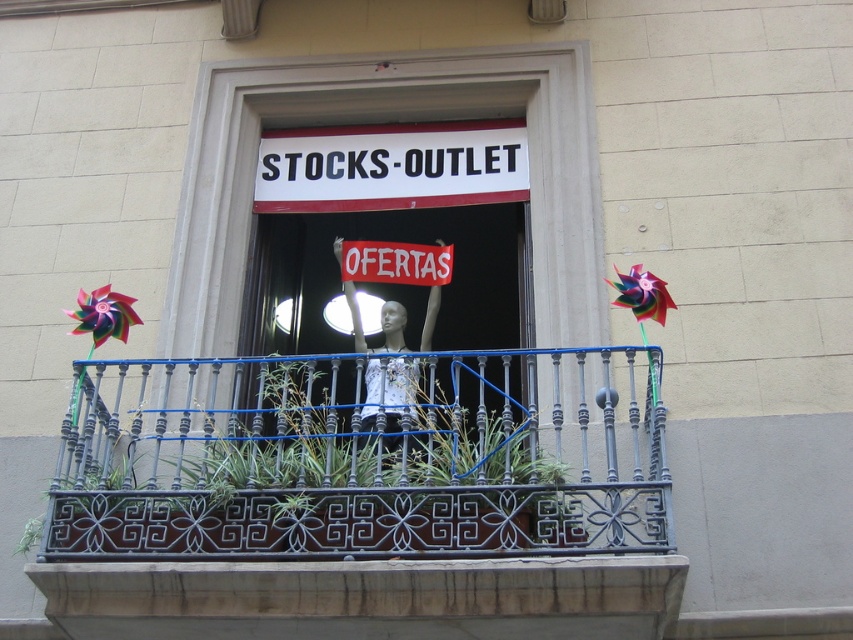
You are a painter standing on the balcony and need to stretch a 3.5 meter long canvas between the dark gray wrought iron at center and the white fabric mannequin at center. Will the canvas be long enough?

The distance between dark gray wrought iron at center and white fabric mannequin at center is 3.18 meters. The canvas is 3.5 meters long, which is longer than the required distance. Therefore, the canvas will be long enough to stretch between them.

You are a delivery person trying to place a new sign on the balcony. The new sign is the same size as the red fabric sign at center. Will the dark gray wrought iron at center block the view of the new sign if placed in the center?

The dark gray wrought iron at center is wider than the red fabric sign at center, so placing the new sign in the center may be blocked by the dark gray wrought iron at center since it is wider.

You are a delivery person trying to place a new sign on the balcony. The new sign is 5 meters long. Can you fit the new sign between the white plastic sign at center and the red fabric sign at center without bending it?

The white plastic sign at center and red fabric sign at center are 5.19 meters apart. Since the new sign is 5 meters long, it can fit between them as the distance is slightly longer than the sign.